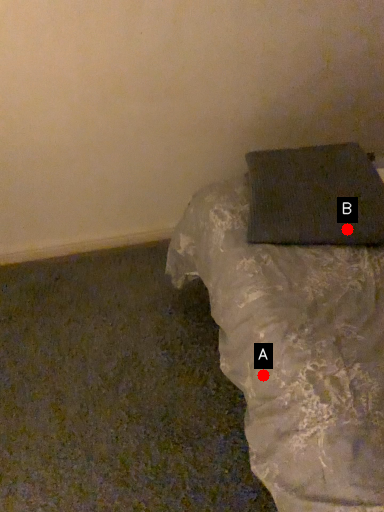
Question: Two points are circled on the image, labeled by A and B beside each circle. Which point appears closest to the camera in this image?

Choices:
 (A) A is closer
 (B) B is closer

Answer: (A)